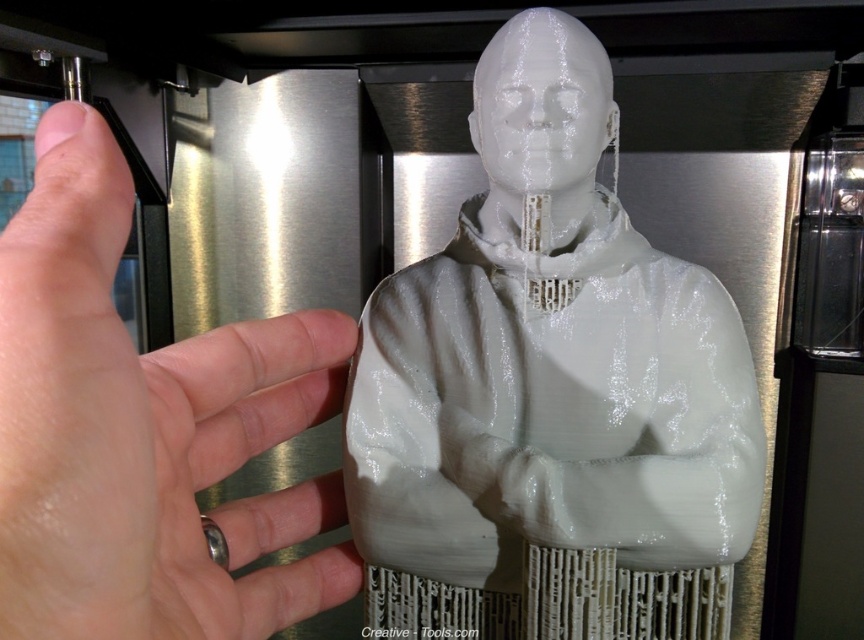
In the scene shown: Can you confirm if white glossy bust at center is shorter than white matte hand at upper left?

Incorrect, white glossy bust at center's height does not fall short of white matte hand at upper left's.

Identify the location of white glossy bust at center. (550, 392).